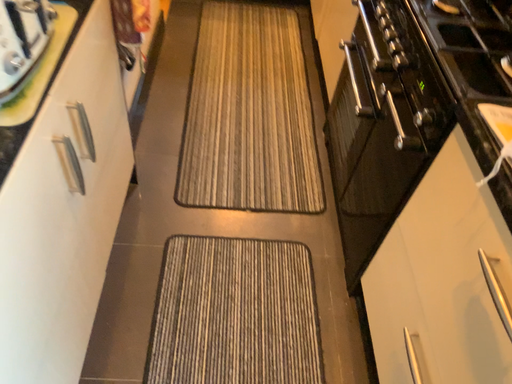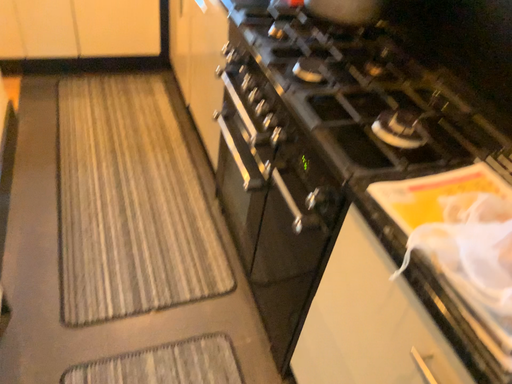
Question: Which way did the camera rotate in the video?

Choices:
 (A) rotated right
 (B) rotated left

Answer: (A)